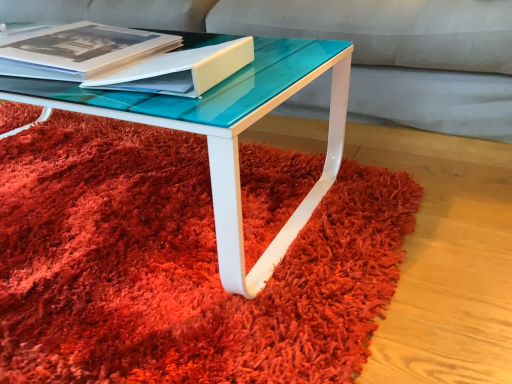
At what (x,y) coordinates should I click in order to perform the action: click on matte white book at center. Please return your answer as a coordinate pair (x, y). Looking at the image, I should click on (180, 70).

Between matte black book at upper left and shaggy red carpet at center, which one has larger width?

With larger width is shaggy red carpet at center.

Is shaggy red carpet at center completely or partially inside matte black book at upper left?

Definitely not — shaggy red carpet at center is not inside matte black book at upper left.

Based on their sizes in the image, would you say matte black book at upper left is bigger or smaller than shaggy red carpet at center?

matte black book at upper left is smaller than shaggy red carpet at center.

Would you consider matte black book at upper left to be distant from shaggy red carpet at center?

No, matte black book at upper left is in close proximity to shaggy red carpet at center.

Can you confirm if matte white book at center is thinner than matte black book at upper left?

Indeed, matte white book at center has a lesser width compared to matte black book at upper left.

Considering the sizes of matte white book at center and matte black book at upper left in the image, is matte white book at center taller or shorter than matte black book at upper left?

matte white book at center is shorter than matte black book at upper left.

Is matte white book at center positioned in front of matte black book at upper left?

Yes, it is.

Based on their sizes in the image, would you say shaggy red carpet at center is bigger or smaller than matte black book at upper left?

In the image, shaggy red carpet at center appears to be larger than matte black book at upper left.

Are shaggy red carpet at center and matte black book at upper left far apart?

No, shaggy red carpet at center is not far away from matte black book at upper left.

Is shaggy red carpet at center oriented towards matte black book at upper left?

No, shaggy red carpet at center is not turned towards matte black book at upper left.

From the picture: From a real-world perspective, is shaggy red carpet at center positioned over matte black book at upper left based on gravity?

Incorrect, from a real-world perspective, shaggy red carpet at center is lower than matte black book at upper left.

Is the surface of shaggy red carpet at center in direct contact with matte white book at center?

No.

Does shaggy red carpet at center lie behind matte white book at center?

No.

Is matte white book at center at the back of shaggy red carpet at center?

shaggy red carpet at center does not have its back to matte white book at center.

The width and height of the screenshot is (512, 384). In order to click on paperback book that is behind the shaggy red carpet at center in this screenshot , I will do `click(180, 70)`.

Locate an element on the screen. Image resolution: width=512 pixels, height=384 pixels. paperback book above the shaggy red carpet at center (from the image's perspective) is located at coordinates (180, 70).

Is matte white book at center facing towards shaggy red carpet at center?

No, matte white book at center does not turn towards shaggy red carpet at center.

Does point (159, 57) lie behind point (277, 158)?

No.

Does matte white book at center have a larger size compared to shaggy red carpet at center?

Actually, matte white book at center might be smaller than shaggy red carpet at center.

Does matte black book at upper left come in front of matte white book at center?

That is False.

From a real-world perspective, is matte black book at upper left on matte white book at center?

No, from a real-world perspective, matte black book at upper left is not over matte white book at center

Considering the relative sizes of matte black book at upper left and matte white book at center in the image provided, is matte black book at upper left bigger than matte white book at center?

Correct, matte black book at upper left is larger in size than matte white book at center.

From the image's perspective, which one is positioned higher, matte black book at upper left or matte white book at center?

matte black book at upper left appears higher in the image.

The height and width of the screenshot is (384, 512). What are the coordinates of `magazine that is above the shaggy red carpet at center (from the image's perspective)` in the screenshot? It's located at (78, 50).

Locate an element on the screen. The image size is (512, 384). magazine that appears below the matte white book at center (from a real-world perspective) is located at coordinates (78, 50).

Based on the photo, which object lies nearer to the anchor point matte black book at upper left, shaggy red carpet at center or matte white book at center?

matte white book at center lies closer to matte black book at upper left than the other object.

Based on the photo, from the image, which object appears to be nearer to shaggy red carpet at center, matte black book at upper left or matte white book at center?

matte white book at center is positioned closer to the anchor shaggy red carpet at center.

When comparing their distances from matte white book at center, does shaggy red carpet at center or matte black book at upper left seem further?

Based on the image, shaggy red carpet at center appears to be further to matte white book at center.

Estimate the real-world distances between objects in this image. Which object is closer to matte white book at center, matte black book at upper left or shaggy red carpet at center?

matte black book at upper left is positioned closer to the anchor matte white book at center.

Considering their positions, is matte white book at center positioned further to matte black book at upper left than shaggy red carpet at center?

shaggy red carpet at center lies further to matte black book at upper left than the other object.

From the picture: From the image, which object appears to be nearer to shaggy red carpet at center, matte white book at center or matte black book at upper left?

matte white book at center is closer to shaggy red carpet at center.

Identify the location of magazine between shaggy red carpet at center and matte white book at center in the horizontal direction. Image resolution: width=512 pixels, height=384 pixels. (78, 50).